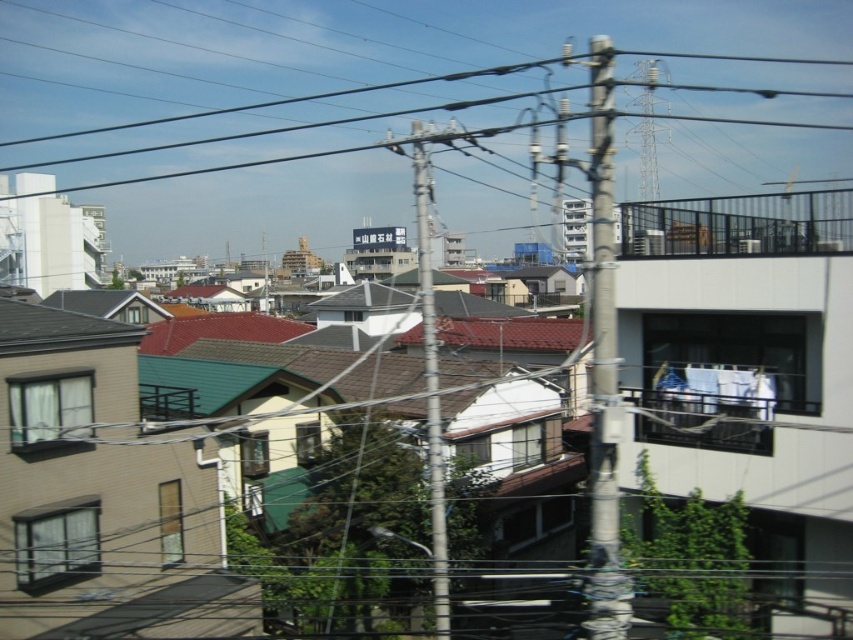
You are a drone operator trying to capture aerial footage of the residential area. You notice the shiny black roof at upper left and the brown tile roof at center. Which roof should you adjust your camera angle to focus on first if you want to start with the closer one?

The shiny black roof at upper left is closer to the viewer than the brown tile roof at center, so you should focus on the shiny black roof at upper left first.

You are a drone operator planning to fly a drone over the residential area. The drone has a maximum flight height of 10 meters. Considering the shiny black roof at upper left and the brown tile roof at center, which roof is safer to fly over without exceeding the height limit?

The shiny black roof at upper left is shorter than the brown tile roof at center, so it is safer to fly over the shiny black roof at upper left since it is lower and less likely to exceed the drone height limit.